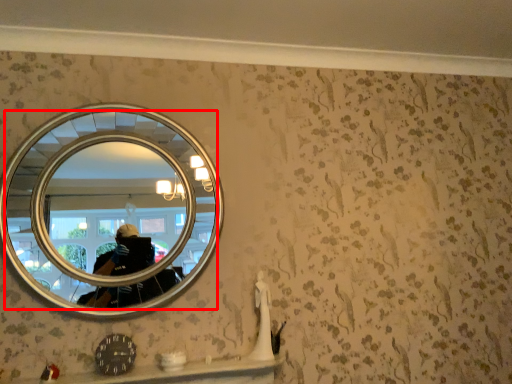
Question: Considering the relative positions of mirror (annotated by the red box) and ledge in the image provided, where is mirror (annotated by the red box) located with respect to the staircase?

Choices:
 (A) left
 (B) right

Answer: (A)